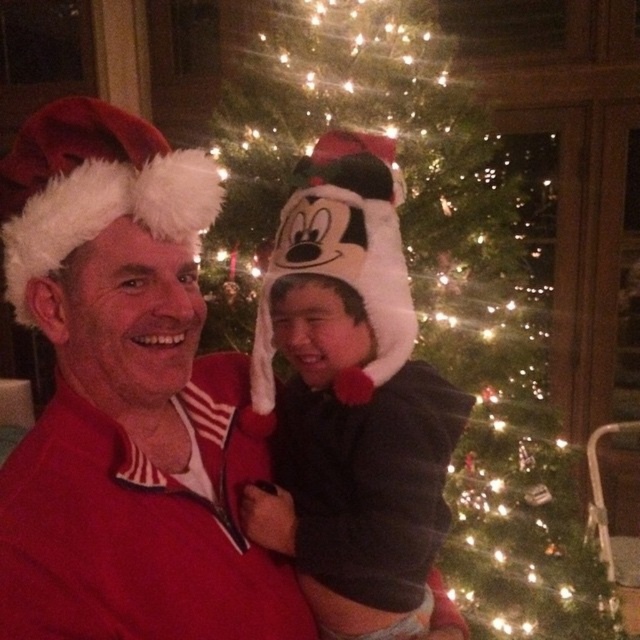
You are a photographer trying to capture a closeup shot of both the matte red santa hat at left and the black fleece hoodie at center. The camera can only focus on objects within 6 inches of each other. Can you take the photo without moving either object?

The matte red santa hat at left is 6.22 inches from the black fleece hoodie at center. Since the distance is slightly over 6 inches, the camera cannot focus on both objects simultaneously without moving them.

You are standing in front of the festive scene with the Christmas tree. You need to place a gift box exactly at point (125, 400). Which object from the scene is already located at that point?

The matte red santa hat at left is located at point (125, 400).